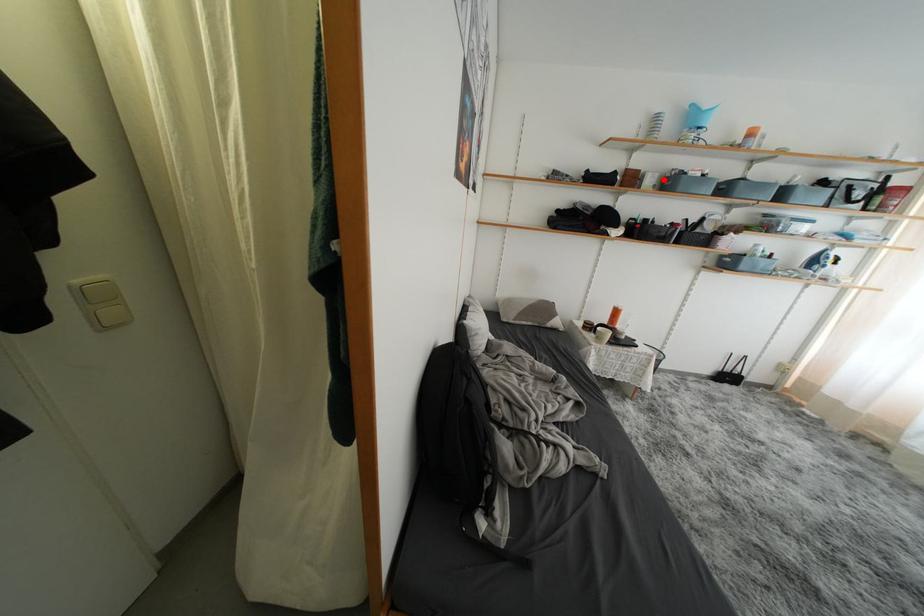
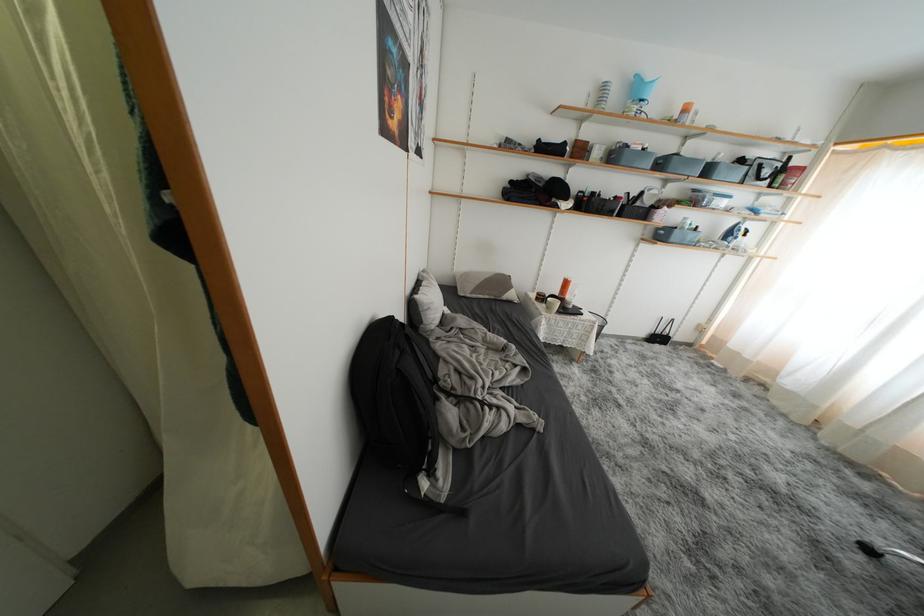
The point at the highlighted location is marked in the first image. Where is the corresponding point in the second image?

(610, 152)